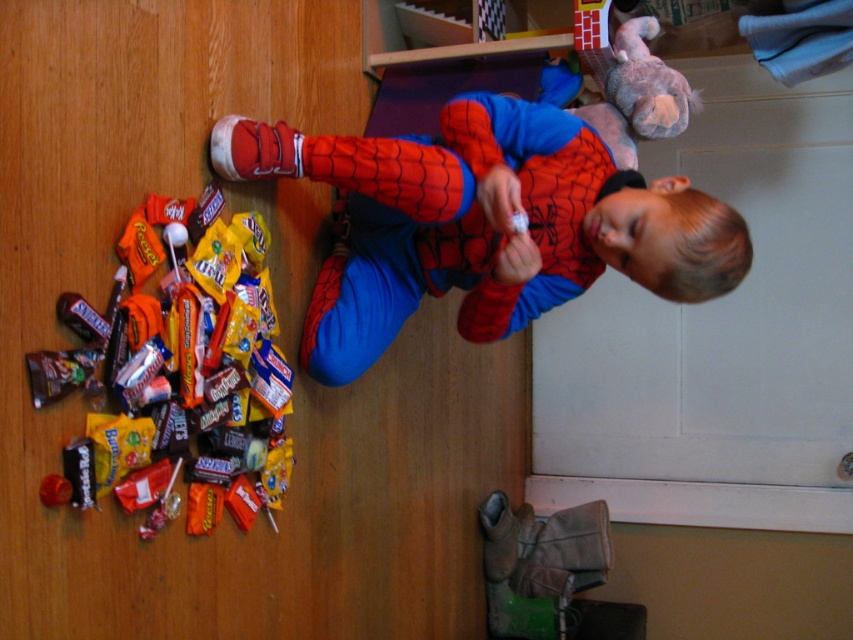
You are a parent trying to put away toys in the playroom. You see the shiny plastic candy at lower left and the fluffy gray stuffed animal at upper right. Which object is taller?

The shiny plastic candy at lower left is much taller than the fluffy gray stuffed animal at upper right.

You are a parent trying to organize the toys in the playroom. You see the matte red costume at center and the shiny plastic candy at lower left. Which object is wider?

The matte red costume at center is wider than the shiny plastic candy at lower left.

You are a parent looking for your child wearing a matte red costume at center in the image. What coordinates should you look at to find them?

The matte red costume at center is located at coordinates point (x=482, y=224).